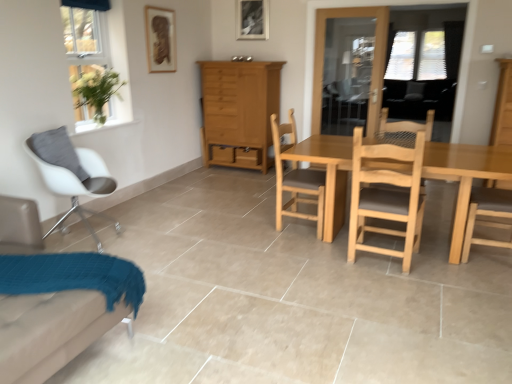
Question: Is white fabric chair at lower left, the 3th chair when ordered from right to left, bigger than light brown wooden table at center right?

Choices:
 (A) yes
 (B) no

Answer: (B)

Question: Is light brown wooden table at center right located within white fabric chair at lower left, arranged as the second chair when viewed from the left?

Choices:
 (A) yes
 (B) no

Answer: (B)

Question: Can you confirm if white fabric chair at lower left, arranged as the second chair when viewed from the left, is smaller than light brown wooden table at center right?

Choices:
 (A) no
 (B) yes

Answer: (B)

Question: Considering the relative positions of white fabric chair at lower left, the 3th chair when ordered from right to left, and light brown wooden table at center right in the image provided, is white fabric chair at lower left, the 3th chair when ordered from right to left, behind light brown wooden table at center right?

Choices:
 (A) no
 (B) yes

Answer: (A)

Question: Is the position of white fabric chair at lower left, the 3th chair when ordered from right to left, less distant than that of light brown wooden table at center right?

Choices:
 (A) no
 (B) yes

Answer: (B)

Question: Does white fabric chair at lower left, arranged as the second chair when viewed from the left, appear on the right side of light brown wooden table at center right?

Choices:
 (A) yes
 (B) no

Answer: (B)

Question: Is transparent glass door at upper right with light brown wood chair at center, placed as the second chair when sorted from right to left?

Choices:
 (A) no
 (B) yes

Answer: (A)

Question: Is the depth of transparent glass door at upper right greater than that of light brown wood chair at center, placed as the second chair when sorted from right to left?

Choices:
 (A) no
 (B) yes

Answer: (B)

Question: Does transparent glass door at upper right appear on the right side of light brown wood chair at center, placed as the second chair when sorted from right to left?

Choices:
 (A) yes
 (B) no

Answer: (A)

Question: From the image's perspective, does transparent glass door at upper right appear lower than light brown wood chair at center, the 3th chair in the left-to-right sequence?

Choices:
 (A) no
 (B) yes

Answer: (A)

Question: Are transparent glass door at upper right and light brown wood chair at center, placed as the second chair when sorted from right to left, located far from each other?

Choices:
 (A) no
 (B) yes

Answer: (B)

Question: Does transparent glass door at upper right have a greater width compared to light brown wood chair at center, the 3th chair in the left-to-right sequence?

Choices:
 (A) yes
 (B) no

Answer: (B)

Question: From a real-world perspective, is light wood dresser at right on white matte chair at left, which is the fourth chair in right-to-left order?

Choices:
 (A) no
 (B) yes

Answer: (B)